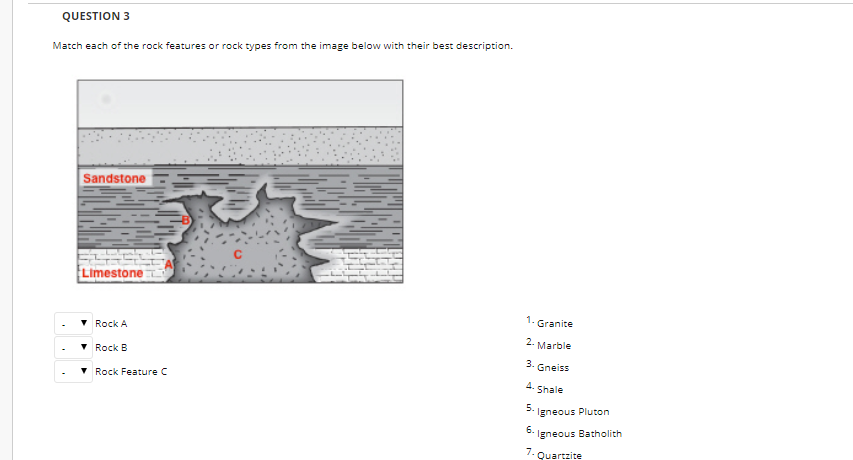
In order to click on marble in this screenshot , I will do [x=573, y=346].